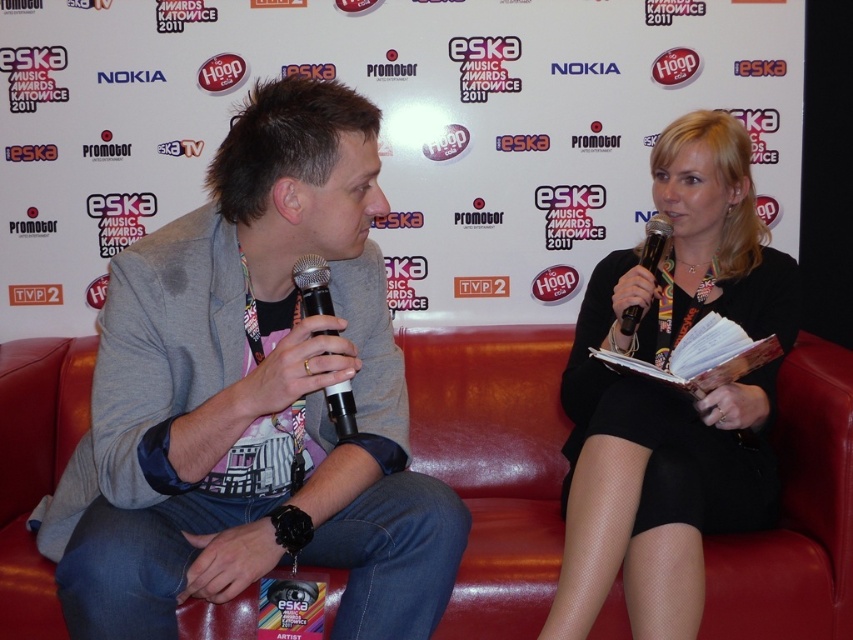
Question: Which point is closer to the camera?

Choices:
 (A) (219, 259)
 (B) (664, 218)
 (C) (788, 410)
 (D) (339, 392)

Answer: (D)

Question: Is gray fabric jacket at left positioned in front of black fabric dress at center?

Choices:
 (A) yes
 (B) no

Answer: (A)

Question: Can you confirm if black metallic microphone at center is thinner than black plastic microphone at upper right?

Choices:
 (A) yes
 (B) no

Answer: (A)

Question: Which object is the farthest from the gray fabric jacket at left?

Choices:
 (A) black metallic microphone at center
 (B) black fabric dress at center
 (C) black plastic microphone at upper right
 (D) leather at center

Answer: (C)

Question: Does gray fabric jacket at left appear on the right side of black plastic microphone at upper right?

Choices:
 (A) yes
 (B) no

Answer: (B)

Question: Which object is closer to the camera taking this photo?

Choices:
 (A) leather at center
 (B) black plastic microphone at upper right

Answer: (B)